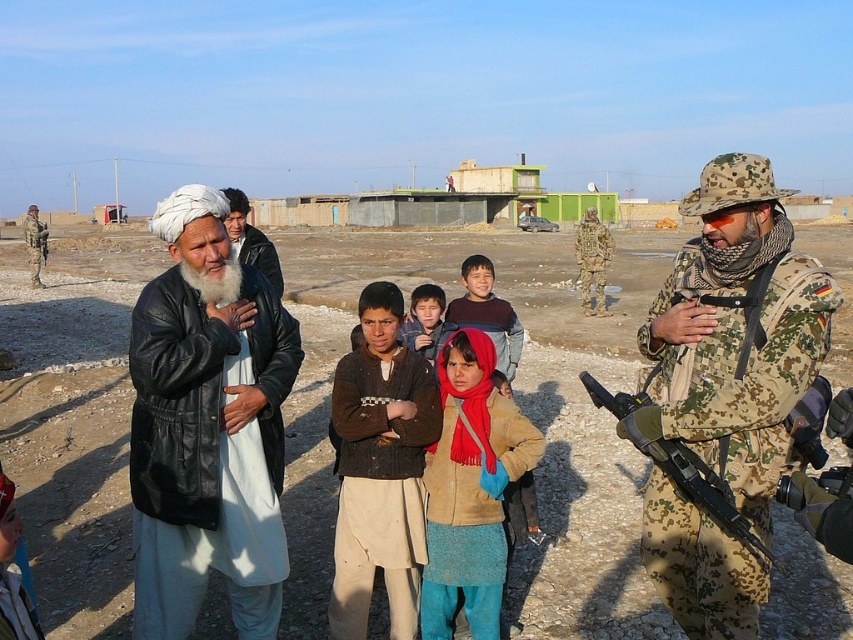
Question: Which point is closer to the camera?

Choices:
 (A) brown wool sweater at center
 (B) camouflage uniform at right

Answer: (B)

Question: Among these points, which one is farthest from the camera?

Choices:
 (A) (x=44, y=248)
 (B) (x=242, y=205)
 (C) (x=642, y=387)

Answer: (A)

Question: Which point is closer to the camera?

Choices:
 (A) (503, 388)
 (B) (683, 490)

Answer: (B)

Question: Is camo uniform at center closer to camera compared to camo fabric rifle at center?

Choices:
 (A) no
 (B) yes

Answer: (B)

Question: Does camouflage uniform at right appear over camo fabric rifle at center?

Choices:
 (A) yes
 (B) no

Answer: (B)

Question: Can you confirm if brown woolen sweater at center is thinner than camo fabric rifle at center?

Choices:
 (A) yes
 (B) no

Answer: (A)